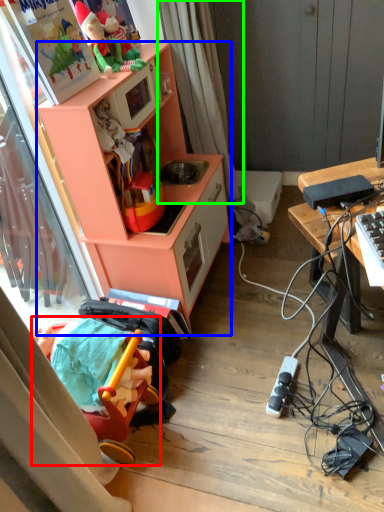
Question: Which object is the farthest from toy (highlighted by a red box)? Choose among these: cabinetry (highlighted by a blue box) or curtain (highlighted by a green box).

Choices:
 (A) cabinetry
 (B) curtain

Answer: (B)